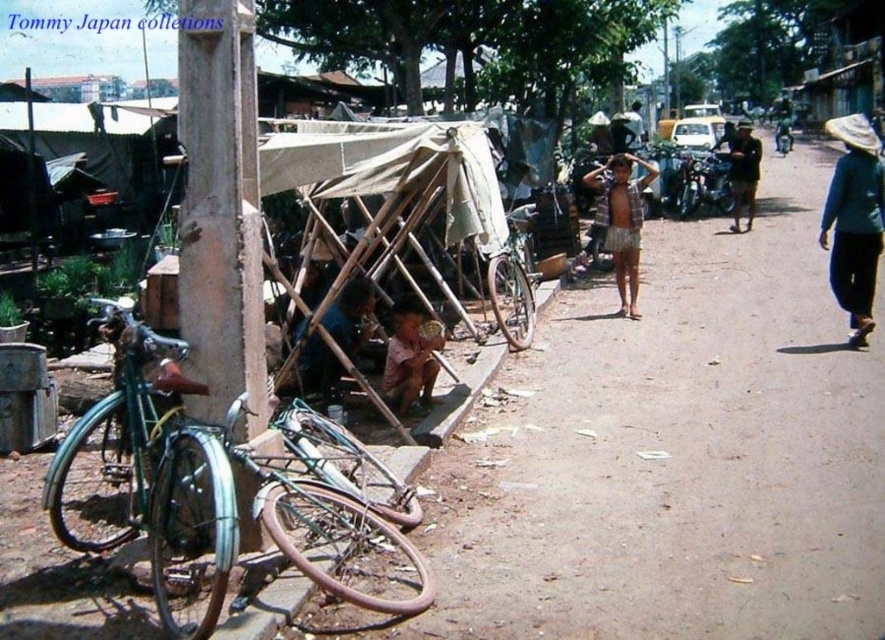
Looking at this image, you are a customer at the Tommy Japan market and want to buy a hat that is taller than the shirt you are currently wearing. Which item should you choose between the blue fabric hat at right and the brown textured shirt at lower center?

The blue fabric hat at right is taller than the brown textured shirt at lower center, so you should choose the blue fabric hat at right.

What is located at the coordinates point (703,180) in the image?

The point (703,180) indicates a shiny chrome motorcycle at center right.